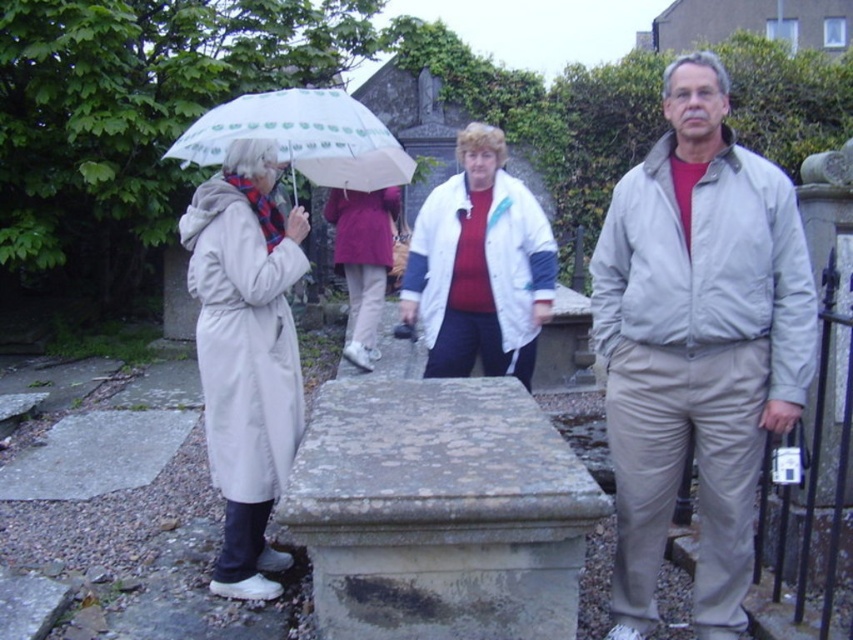
You are a photographer trying to capture a clear shot of both the light beige trench coat at left and the transparent plastic umbrella at upper left. Given their sizes, which object should you focus on first to ensure it fits entirely within your camera frame?

The light beige trench coat at left occupies less space than the transparent plastic umbrella at upper left, so you should focus on capturing the transparent plastic umbrella at upper left first to ensure it fits entirely within your camera frame since it is larger.

You are a photographer standing 2 meters away from the camera. You want to take a photo of the light beige trench coat at left. Can you reach the camera to adjust it without moving from your current position?

The distance between you and the camera is 2 meters, and the light beige trench coat at left is 3.37 meters away from the camera. Since you are 2 meters away from the camera, the total distance to the coat is 5.37 meters. You cannot reach the camera to adjust it without moving closer.

You are standing in the cemetery scene and want to know which clothing item is closer to you between the light beige jacket at right and the light beige trench coat at left. Based on their positions, which one is nearer?

The light beige jacket at right is positioned over the light beige trench coat at left, meaning it is closer to you.